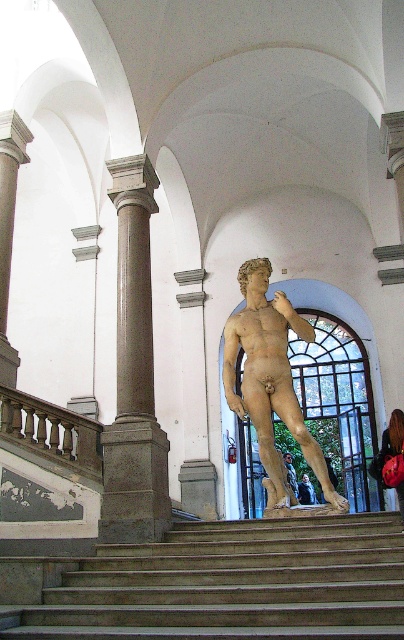
You are an architect designing a new exhibition space. You need to place a 10 meter long display case between the dark brown polished wood railing at left and the bronze statue at center. Is there enough space between them to fit the display case?

The dark brown polished wood railing at left and bronze statue at center are 11.68 meters apart, so yes, the 10 meter long display case can fit between them since the distance is greater than the display case length.

You are standing in the grand interior space and want to move from the entrance to the statue in the center. Which object, the brown stone column at left or the dark brown polished wood railing at left, would you encounter first?

The brown stone column at left is closer to the viewer than the dark brown polished wood railing at left, so you would encounter the brown stone column at left first.

You are a maintenance worker needing to replace a loose bolt on the dark brown polished wood railing at left. You have a ladder that is 2 meters long. The brown stone column at left is in your way. Can you move the ladder horizontally between the two objects to reach the railing?

The brown stone column at left and dark brown polished wood railing at left are 2.85 meters apart. Since the ladder is 2 meters long, it can be moved horizontally between them as the distance between the two objects is greater than the ladder length.